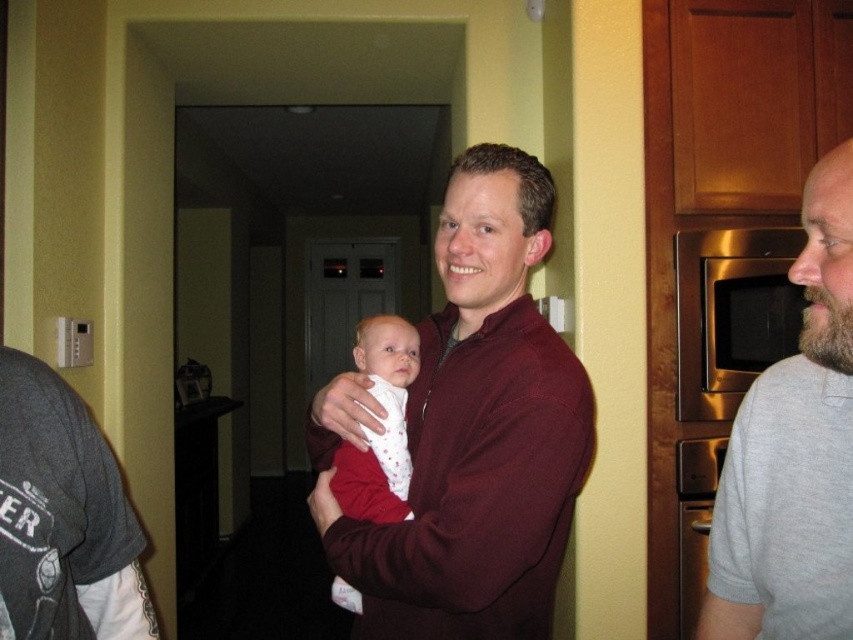
Question: Which object is farther from the camera taking this photo?

Choices:
 (A) white soft baby at center
 (B) dark gray t-shirt at left
 (C) maroon sweater at center
 (D) gray cotton arm at right

Answer: (A)

Question: Which object appears farthest from the camera in this image?

Choices:
 (A) gray cotton arm at right
 (B) dark gray t-shirt at left
 (C) maroon sweater at center

Answer: (C)

Question: Estimate the real-world distances between objects in this image. Which object is closer to the gray cotton shirt at right?

Choices:
 (A) white soft baby at center
 (B) maroon sweater at center
 (C) dark gray t-shirt at left

Answer: (B)

Question: Is white soft baby at center to the right of gray cotton arm at right from the viewer's perspective?

Choices:
 (A) yes
 (B) no

Answer: (B)

Question: Can you confirm if gray cotton shirt at right is positioned to the left of dark gray t-shirt at left?

Choices:
 (A) no
 (B) yes

Answer: (A)

Question: Does dark gray t-shirt at left have a greater width compared to white soft baby at center?

Choices:
 (A) no
 (B) yes

Answer: (A)